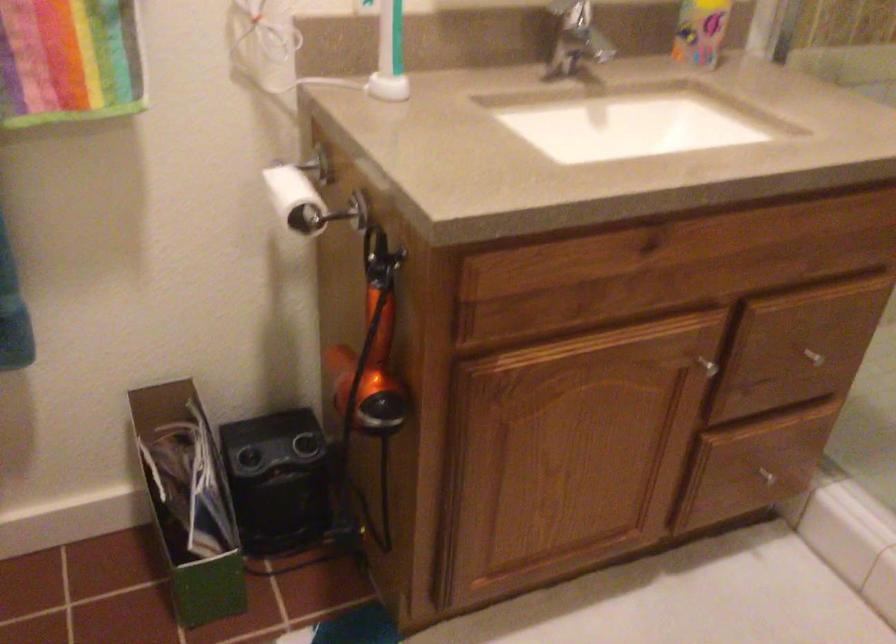
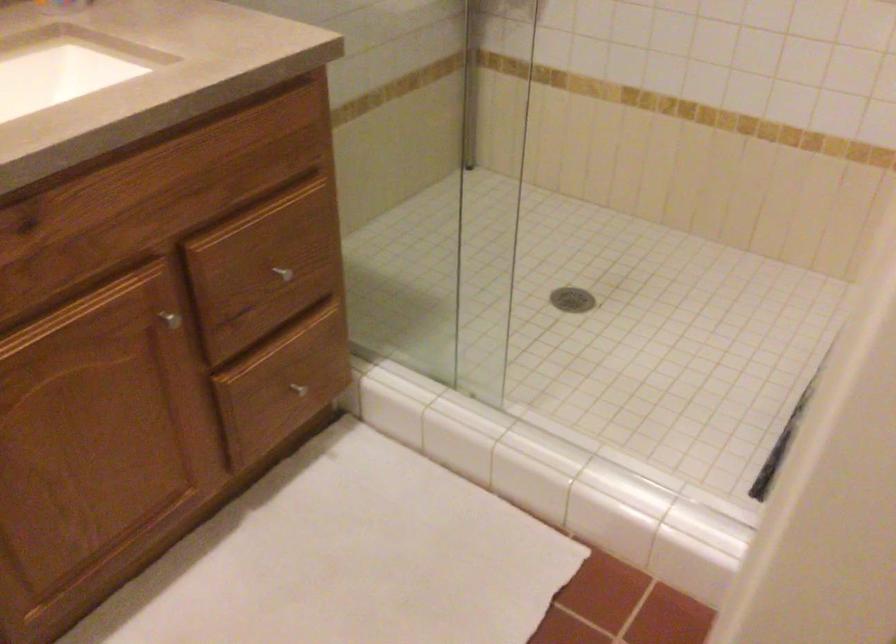
The point at (811, 357) is marked in the first image. Where is the corresponding point in the second image?

(281, 272)